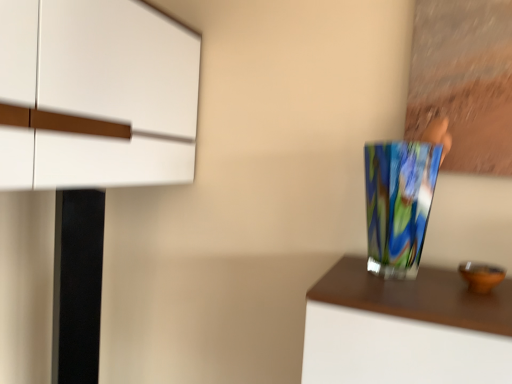
The image size is (512, 384). Describe the element at coordinates (97, 94) in the screenshot. I see `white matte cabinet at upper left` at that location.

In order to face white matte cabinet at upper left, should I rotate leftwards or rightwards?

Rotate your view left by about 23.753°.

Where is `white matte cabinet at upper left`? Image resolution: width=512 pixels, height=384 pixels. white matte cabinet at upper left is located at coordinates pos(97,94).

The width and height of the screenshot is (512, 384). I want to click on multicolored glass vase at right, so click(x=398, y=204).

What do you see at coordinates (398, 204) in the screenshot? The height and width of the screenshot is (384, 512). I see `multicolored glass vase at right` at bounding box center [398, 204].

In order to click on white matte cabinet at upper left in this screenshot , I will do `click(97, 94)`.

Is white matte cabinet at upper left at the left side of multicolored glass vase at right?

Indeed, white matte cabinet at upper left is positioned on the left side of multicolored glass vase at right.

Which object is further away from the camera, white matte cabinet at upper left or multicolored glass vase at right?

multicolored glass vase at right is further away from the camera.

Is point (93, 144) closer or farther from the camera than point (428, 183)?

Point (93, 144).

From the image's perspective, is white matte cabinet at upper left on top of multicolored glass vase at right?

Yes, from the image's perspective, white matte cabinet at upper left is above multicolored glass vase at right.

From a real-world perspective, is white matte cabinet at upper left on multicolored glass vase at right?

Correct, in the physical world, white matte cabinet at upper left is higher than multicolored glass vase at right.

Which object is wider, white matte cabinet at upper left or multicolored glass vase at right?

Wider between the two is white matte cabinet at upper left.

In terms of height, does white matte cabinet at upper left look taller or shorter compared to multicolored glass vase at right?

Answer: Considering their sizes, white matte cabinet at upper left has more height than multicolored glass vase at right.

In terms of size, does white matte cabinet at upper left appear bigger or smaller than multicolored glass vase at right?

Clearly, white matte cabinet at upper left is larger in size than multicolored glass vase at right.

From the picture: Would you say white matte cabinet at upper left is inside or outside multicolored glass vase at right?

white matte cabinet at upper left is outside multicolored glass vase at right.

Is white matte cabinet at upper left far from multicolored glass vase at right?

Actually, white matte cabinet at upper left and multicolored glass vase at right are a little close together.

Is multicolored glass vase at right at the back of white matte cabinet at upper left?

white matte cabinet at upper left is not turned away from multicolored glass vase at right.

How many degrees apart are the facing directions of white matte cabinet at upper left and multicolored glass vase at right?

89.5 degrees.

Locate an element on the screen. cabinetry in front of the multicolored glass vase at right is located at coordinates (97, 94).

Considering the relative positions of multicolored glass vase at right and white matte cabinet at upper left in the image provided, is multicolored glass vase at right to the left or to the right of white matte cabinet at upper left?

From the image, it's evident that multicolored glass vase at right is to the right of white matte cabinet at upper left.

Is multicolored glass vase at right in front of or behind white matte cabinet at upper left in the image?

Clearly, multicolored glass vase at right is behind white matte cabinet at upper left.

Considering the points (415, 228) and (155, 29), which point is in front, point (415, 228) or point (155, 29)?

The point (415, 228) is closer to the camera.

From the image's perspective, who appears lower, multicolored glass vase at right or white matte cabinet at upper left?

multicolored glass vase at right appears lower in the image.

From a real-world perspective, is multicolored glass vase at right over white matte cabinet at upper left?

No, from a real-world perspective, multicolored glass vase at right is not above white matte cabinet at upper left.

Is multicolored glass vase at right thinner than white matte cabinet at upper left?

Yes, multicolored glass vase at right is thinner than white matte cabinet at upper left.

Between multicolored glass vase at right and white matte cabinet at upper left, which one has less height?

Answer: With less height is multicolored glass vase at right.

Considering the sizes of objects multicolored glass vase at right and white matte cabinet at upper left in the image provided, who is bigger, multicolored glass vase at right or white matte cabinet at upper left?

white matte cabinet at upper left is bigger.

Would you say multicolored glass vase at right is inside or outside white matte cabinet at upper left?

multicolored glass vase at right is spatially situated outside white matte cabinet at upper left.

Are multicolored glass vase at right and white matte cabinet at upper left beside each other?

multicolored glass vase at right is not next to white matte cabinet at upper left, and they're not touching.

Could you tell me if multicolored glass vase at right is turned towards white matte cabinet at upper left?

No, multicolored glass vase at right is not aimed at white matte cabinet at upper left.

The height and width of the screenshot is (384, 512). What are the coordinates of `cabinetry located on the left of multicolored glass vase at right` in the screenshot? It's located at 97,94.

In the image, there is a white matte cabinet at upper left. What are the coordinates of `vase below it (from the image's perspective)` in the screenshot? It's located at (398, 204).

Identify the location of cabinetry on the left of multicolored glass vase at right. The image size is (512, 384). (97, 94).